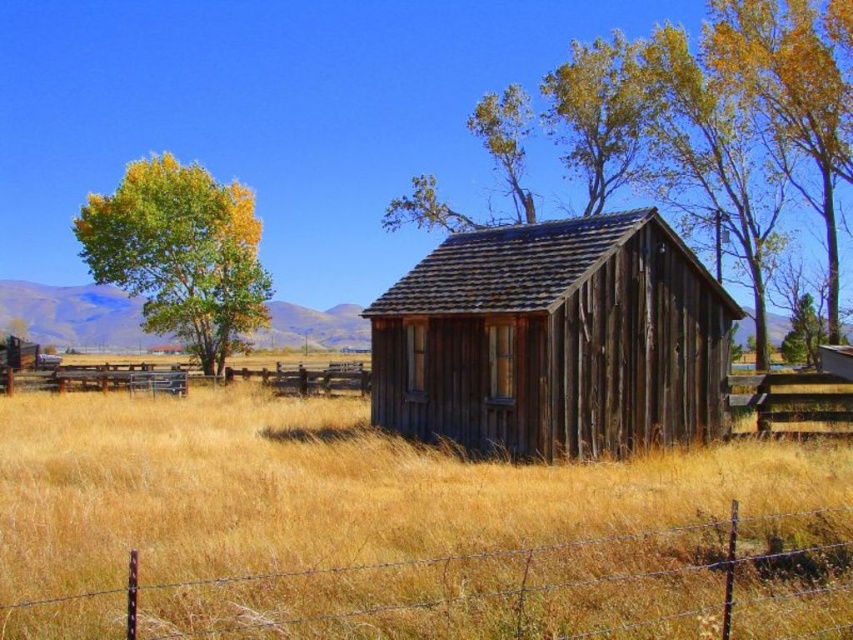
Who is taller, green leafy tree at left or brown wooden fence at lower left?

Standing taller between the two is green leafy tree at left.

Measure the distance between green leafy tree at left and camera.

green leafy tree at left is 37.21 meters from camera.

Is point (160, 212) positioned behind point (94, 385)?

Yes, point (160, 212) is behind point (94, 385).

Identify the location of green leafy tree at left. This screenshot has width=853, height=640. [178, 253].

Is point (514, 568) positioned before point (143, 208)?

Yes, point (514, 568) is closer to viewer.

Who is shorter, brown wire fence at lower center or green leafy tree at left?

brown wire fence at lower center

The height and width of the screenshot is (640, 853). Identify the location of brown wire fence at lower center. (502, 592).

Is weathered wood barn at center positioned at the back of green leafy tree at left?

No.

Which is in front, point (561, 324) or point (213, 289)?

Point (561, 324) is more forward.

Is point (624, 348) farther from viewer compared to point (248, 216)?

No, (624, 348) is in front of (248, 216).

What are the coordinates of `weathered wood barn at center` in the screenshot? It's located at (553, 340).